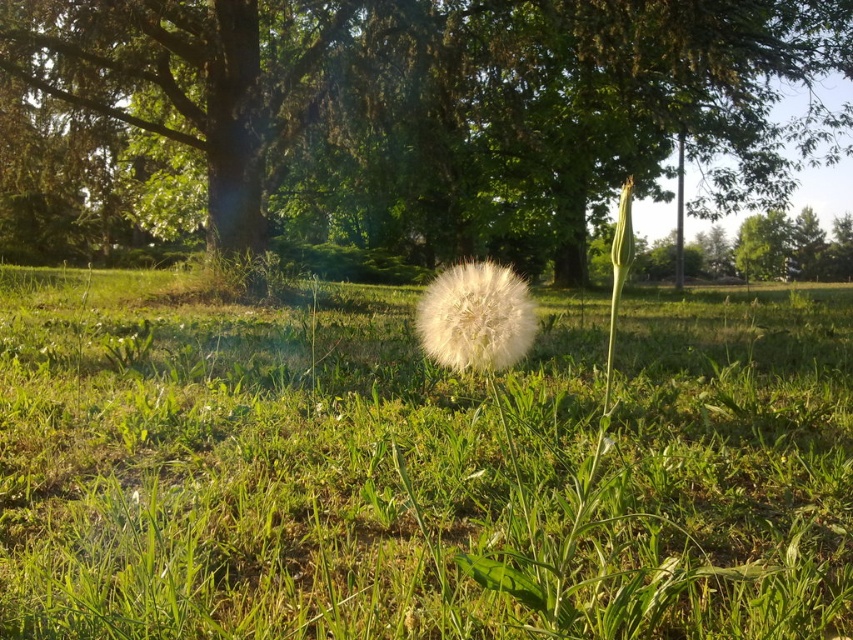
Question: Does brown textured tree at center lie in front of white fluffy dandelion at center?

Choices:
 (A) no
 (B) yes

Answer: (A)

Question: Does brown textured tree at center appear on the right side of white fluffy dandelion at center?

Choices:
 (A) no
 (B) yes

Answer: (A)

Question: Can you confirm if green grassy at center is positioned to the right of white fluffy dandelion at center?

Choices:
 (A) yes
 (B) no

Answer: (A)

Question: Among these points, which one is nearest to the camera?

Choices:
 (A) (811, 72)
 (B) (444, 328)
 (C) (569, 417)

Answer: (B)

Question: Considering the real-world distances, which object is closest to the white fluffy dandelion at center?

Choices:
 (A) green grassy at center
 (B) brown textured tree at center

Answer: (A)

Question: Which is farther from the brown textured tree at center?

Choices:
 (A) white fluffy dandelion at center
 (B) green grassy at center

Answer: (A)